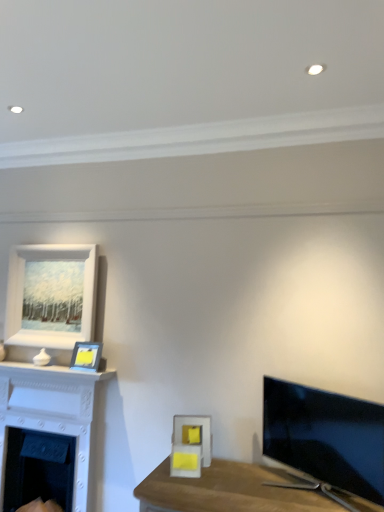
Measure the distance between white matte fireplace at lower left, the first fireplace from the bottom, and camera.

They are 2.89 meters apart.

Measure the distance between white glossy fireplace at left, the second fireplace when ordered from bottom to top, and camera.

white glossy fireplace at left, the second fireplace when ordered from bottom to top, and camera are 9.28 feet apart from each other.

The height and width of the screenshot is (512, 384). What do you see at coordinates (86, 356) in the screenshot? I see `matte yellow picture frame at upper left, the second picture frame from the right` at bounding box center [86, 356].

The image size is (384, 512). Describe the element at coordinates (326, 436) in the screenshot. I see `satin black tv at right` at that location.

The height and width of the screenshot is (512, 384). I want to click on matte yellow picture frame at center, the third picture frame viewed from the top, so click(190, 445).

From the image's perspective, is satin black tv at right positioned above or below white matte fireplace at lower left, placed as the second fireplace when sorted from top to bottom?

Based on their image positions, satin black tv at right is located above white matte fireplace at lower left, placed as the second fireplace when sorted from top to bottom.

Is satin black tv at right taller or shorter than white matte fireplace at lower left, the first fireplace from the bottom?

Clearly, satin black tv at right is shorter compared to white matte fireplace at lower left, the first fireplace from the bottom.

Image resolution: width=384 pixels, height=512 pixels. Find the location of `the 1st fireplace counting from the left side of the satin black tv at right`. the 1st fireplace counting from the left side of the satin black tv at right is located at coordinates (38, 468).

Between matte yellow picture frame at upper left, the second picture frame from the back, and white glossy fireplace at left, the second fireplace when ordered from bottom to top, which one has smaller size?

matte yellow picture frame at upper left, the second picture frame from the back.

Based on the photo, is matte yellow picture frame at upper left, arranged as the second picture frame when ordered from the bottom, taller or shorter than white glossy fireplace at left, placed as the 1th fireplace when sorted from top to bottom?

Considering their sizes, matte yellow picture frame at upper left, arranged as the second picture frame when ordered from the bottom, has less height than white glossy fireplace at left, placed as the 1th fireplace when sorted from top to bottom.

Can you tell me how much matte yellow picture frame at upper left, arranged as the second picture frame when viewed from the top, and white glossy fireplace at left, placed as the 1th fireplace when sorted from top to bottom, differ in facing direction?

8.36 degrees separate the facing orientations of matte yellow picture frame at upper left, arranged as the second picture frame when viewed from the top, and white glossy fireplace at left, placed as the 1th fireplace when sorted from top to bottom.

Is white glossy fireplace at left, placed as the 1th fireplace when sorted from top to bottom, at the back of matte yellow picture frame at upper left, which is the 2th picture frame in front-to-back order?

No.

Are white glossy fireplace at left, placed as the 1th fireplace when sorted from top to bottom, and white matte fireplace at lower left, the first fireplace from the bottom, far apart?

No, white glossy fireplace at left, placed as the 1th fireplace when sorted from top to bottom, is in close proximity to white matte fireplace at lower left, the first fireplace from the bottom.

From the image's perspective, is white glossy fireplace at left, placed as the 1th fireplace when sorted from top to bottom, located above or below white matte fireplace at lower left, the first fireplace from the bottom?

From the image's perspective, white glossy fireplace at left, placed as the 1th fireplace when sorted from top to bottom, appears above white matte fireplace at lower left, the first fireplace from the bottom.

Considering the positions of objects white glossy fireplace at left, the second fireplace when ordered from bottom to top, and white matte fireplace at lower left, the first fireplace from the bottom, in the image provided, who is more to the left, white glossy fireplace at left, the second fireplace when ordered from bottom to top, or white matte fireplace at lower left, the first fireplace from the bottom,?

white glossy fireplace at left, the second fireplace when ordered from bottom to top, is more to the left.

From the image's perspective, is white glossy fireplace at left, placed as the 1th fireplace when sorted from top to bottom, over matte yellow picture frame at upper left, the second picture frame from the right?

No, from the image's perspective, white glossy fireplace at left, placed as the 1th fireplace when sorted from top to bottom, is not above matte yellow picture frame at upper left, the second picture frame from the right.

The width and height of the screenshot is (384, 512). I want to click on the 2nd fireplace to the left of the matte yellow picture frame at upper left, which is the 2th picture frame in front-to-back order, counting from the anchor's position, so click(57, 418).

From a real-world perspective, is white glossy fireplace at left, the second fireplace when ordered from bottom to top, positioned above or below matte yellow picture frame at upper left, arranged as the second picture frame when ordered from the bottom?

Clearly, from a real-world perspective, white glossy fireplace at left, the second fireplace when ordered from bottom to top, is below matte yellow picture frame at upper left, arranged as the second picture frame when ordered from the bottom.

Is the depth of white glossy fireplace at left, the second fireplace when ordered from bottom to top, greater than that of matte yellow picture frame at upper left, the second picture frame from the right?

No, the depth of white glossy fireplace at left, the second fireplace when ordered from bottom to top, is less than that of matte yellow picture frame at upper left, the second picture frame from the right.

From the image's perspective, which one is positioned lower, white matte fireplace at lower left, placed as the second fireplace when sorted from top to bottom, or matte yellow picture frame at upper left, the second picture frame from the back?

Result: white matte fireplace at lower left, placed as the second fireplace when sorted from top to bottom.

From the picture: Considering the sizes of objects white matte fireplace at lower left, placed as the second fireplace when sorted from top to bottom, and matte yellow picture frame at upper left, arranged as the second picture frame when ordered from the bottom, in the image provided, who is bigger, white matte fireplace at lower left, placed as the second fireplace when sorted from top to bottom, or matte yellow picture frame at upper left, arranged as the second picture frame when ordered from the bottom,?

white matte fireplace at lower left, placed as the second fireplace when sorted from top to bottom.

Considering the relative sizes of white matte fireplace at lower left, the first fireplace from the bottom, and matte yellow picture frame at upper left, the second picture frame from the back, in the image provided, is white matte fireplace at lower left, the first fireplace from the bottom, wider than matte yellow picture frame at upper left, the second picture frame from the back,?

Yes, white matte fireplace at lower left, the first fireplace from the bottom, is wider than matte yellow picture frame at upper left, the second picture frame from the back.

How different are the orientations of white matte fireplace at lower left, the first fireplace from the bottom, and matte yellow picture frame at upper left, the second picture frame from the right, in degrees?

white matte fireplace at lower left, the first fireplace from the bottom, and matte yellow picture frame at upper left, the second picture frame from the right, are facing 9.74 degrees away from each other.

Is white matte fireplace at lower left, placed as the second fireplace when sorted from top to bottom, thinner than satin black tv at right?

Indeed, white matte fireplace at lower left, placed as the second fireplace when sorted from top to bottom, has a lesser width compared to satin black tv at right.

From the image's perspective, which object appears higher, white matte fireplace at lower left, placed as the second fireplace when sorted from top to bottom, or satin black tv at right?

satin black tv at right, from the image's perspective.

Would you say white matte fireplace at lower left, placed as the second fireplace when sorted from top to bottom, is outside satin black tv at right?

That's correct, white matte fireplace at lower left, placed as the second fireplace when sorted from top to bottom, is outside of satin black tv at right.

From a real-world perspective, does matte yellow picture frame at center, the third picture frame viewed from the top, sit lower than matte yellow picture frame at upper left, arranged as the second picture frame when ordered from the bottom?

Indeed, from a real-world perspective, matte yellow picture frame at center, the third picture frame viewed from the top, is positioned beneath matte yellow picture frame at upper left, arranged as the second picture frame when ordered from the bottom.

Relative to matte yellow picture frame at upper left, which is the 2th picture frame in front-to-back order, is matte yellow picture frame at center, marked as the 1th picture frame in a right-to-left arrangement, in front or behind?

Visually, matte yellow picture frame at center, marked as the 1th picture frame in a right-to-left arrangement, is located in front of matte yellow picture frame at upper left, which is the 2th picture frame in front-to-back order.

Which is closer to the camera, (172, 474) or (86, 342)?

Point (172, 474) is closer to the camera than point (86, 342).

At what (x,y) coordinates should I click in order to perform the action: click on the 1st picture frame above when counting from the matte yellow picture frame at center, the 1th picture frame viewed from the front (from the image's perspective). Please return your answer as a coordinate pair (x, y). The image size is (384, 512). Looking at the image, I should click on (86, 356).

Identify the location of television on the right of white matte fireplace at lower left, placed as the second fireplace when sorted from top to bottom. (326, 436).

Where is `the 2nd fireplace in front of the matte yellow picture frame at upper left, which is the 2th picture frame in front-to-back order, starting your count from the anchor`? the 2nd fireplace in front of the matte yellow picture frame at upper left, which is the 2th picture frame in front-to-back order, starting your count from the anchor is located at coordinates (57, 418).

From the image, which object appears to be nearer to white matte fireplace at lower left, placed as the second fireplace when sorted from top to bottom, white glossy fireplace at left, the second fireplace when ordered from bottom to top, or white matte picture frame at upper left, the first picture frame from the left?

white glossy fireplace at left, the second fireplace when ordered from bottom to top, is closer to white matte fireplace at lower left, placed as the second fireplace when sorted from top to bottom.

Estimate the real-world distances between objects in this image. Which object is closer to satin black tv at right, white matte fireplace at lower left, placed as the second fireplace when sorted from top to bottom, or white matte picture frame at upper left, the first picture frame from the left?

The object closer to satin black tv at right is white matte picture frame at upper left, the first picture frame from the left.

From the picture: From the image, which object appears to be farther from matte yellow picture frame at center, the third picture frame viewed from the top, white glossy fireplace at left, the second fireplace when ordered from bottom to top, or white matte picture frame at upper left, marked as the third picture frame in a bottom-to-top arrangement?

Among the two, white matte picture frame at upper left, marked as the third picture frame in a bottom-to-top arrangement, is located further to matte yellow picture frame at center, the third picture frame viewed from the top.

Based on their spatial positions, is white matte picture frame at upper left, acting as the 1th picture frame starting from the back, or matte yellow picture frame at center, which is counted as the 3th picture frame, starting from the back, further from satin black tv at right?

white matte picture frame at upper left, acting as the 1th picture frame starting from the back, is positioned further to the anchor satin black tv at right.

Based on their spatial positions, is white matte picture frame at upper left, acting as the 1th picture frame starting from the back, or matte yellow picture frame at center, the third picture frame viewed from the top, further from white glossy fireplace at left, the second fireplace when ordered from bottom to top?

Among the two, matte yellow picture frame at center, the third picture frame viewed from the top, is located further to white glossy fireplace at left, the second fireplace when ordered from bottom to top.

Looking at this image, from the image, which object appears to be nearer to satin black tv at right, white glossy fireplace at left, placed as the 1th fireplace when sorted from top to bottom, or white matte fireplace at lower left, the first fireplace from the bottom?

Among the two, white glossy fireplace at left, placed as the 1th fireplace when sorted from top to bottom, is located nearer to satin black tv at right.

Which object lies further to the anchor point satin black tv at right, matte yellow picture frame at center, marked as the 1th picture frame in a right-to-left arrangement, or white matte picture frame at upper left, arranged as the 3th picture frame when viewed from the right?

white matte picture frame at upper left, arranged as the 3th picture frame when viewed from the right, is further to satin black tv at right.

Based on their spatial positions, is satin black tv at right or matte yellow picture frame at center, which ranks as the 1th picture frame in bottom-to-top order, closer to matte yellow picture frame at upper left, arranged as the second picture frame when viewed from the top?

matte yellow picture frame at center, which ranks as the 1th picture frame in bottom-to-top order, is closer to matte yellow picture frame at upper left, arranged as the second picture frame when viewed from the top.

Locate an element on the screen. This screenshot has width=384, height=512. fireplace between white glossy fireplace at left, placed as the 1th fireplace when sorted from top to bottom, and satin black tv at right is located at coordinates (38, 468).

Where is `picture frame between matte yellow picture frame at upper left, the second picture frame from the back, and satin black tv at right, in the horizontal direction`? This screenshot has height=512, width=384. picture frame between matte yellow picture frame at upper left, the second picture frame from the back, and satin black tv at right, in the horizontal direction is located at coordinates (190, 445).

You are a GUI agent. You are given a task and a screenshot of the screen. Output one action in this format:
    pyautogui.click(x=<x>, y=<y>)
    Task: Click on the picture frame between white matte picture frame at upper left, arranged as the 3th picture frame when viewed from the right, and matte yellow picture frame at center, the 1th picture frame viewed from the front, from left to right
    
    Given the screenshot: What is the action you would take?
    pyautogui.click(x=86, y=356)

The width and height of the screenshot is (384, 512). Identify the location of fireplace between white glossy fireplace at left, the second fireplace when ordered from bottom to top, and matte yellow picture frame at center, which is counted as the 3th picture frame, starting from the back, in the horizontal direction. (38, 468).